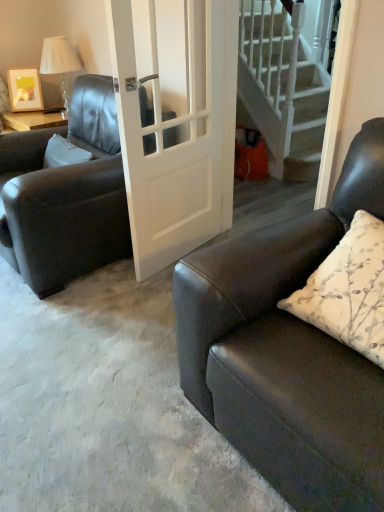
Locate an element on the screen. The height and width of the screenshot is (512, 384). wooden picture frame at upper left is located at coordinates (25, 90).

This screenshot has height=512, width=384. What do you see at coordinates (180, 143) in the screenshot? I see `white glossy door at center` at bounding box center [180, 143].

What do you see at coordinates (348, 290) in the screenshot?
I see `white floral pillow at right` at bounding box center [348, 290].

What do you see at coordinates (287, 351) in the screenshot? I see `matte black couch at right` at bounding box center [287, 351].

Find the location of `wooden picture frame at upper left`. wooden picture frame at upper left is located at coordinates (25, 90).

Locate an element on the screen. pillow below the wooden picture frame at upper left (from a real-world perspective) is located at coordinates (348, 290).

Considering the positions of objects wooden picture frame at upper left and white floral pillow at right in the image provided, who is in front, wooden picture frame at upper left or white floral pillow at right?

white floral pillow at right.

From the image's perspective, is wooden picture frame at upper left under white floral pillow at right?

No.

Is white fabric lampshade at upper left further to the viewer compared to white glossy door at center?

That is True.

Between white fabric lampshade at upper left and white glossy door at center, which one has less height?

white fabric lampshade at upper left.

The height and width of the screenshot is (512, 384). Find the location of `door that is below the white fabric lampshade at upper left (from the image's perspective)`. door that is below the white fabric lampshade at upper left (from the image's perspective) is located at coordinates (180, 143).

Is white wooden stairs at upper right far away from white glossy door at center?

Yes.

From a real-world perspective, is white wooden stairs at upper right positioned over white glossy door at center based on gravity?

No, from a real-world perspective, white wooden stairs at upper right is not over white glossy door at center

Which object is positioned more to the left, white wooden stairs at upper right or white glossy door at center?

white glossy door at center.

Considering the sizes of wooden picture frame at upper left and white fabric lampshade at upper left in the image, is wooden picture frame at upper left taller or shorter than white fabric lampshade at upper left?

Clearly, wooden picture frame at upper left is shorter compared to white fabric lampshade at upper left.

From a real-world perspective, relative to white fabric lampshade at upper left, is wooden picture frame at upper left vertically above or below?

From a real-world perspective, wooden picture frame at upper left is physically below white fabric lampshade at upper left.

Does wooden picture frame at upper left touch white fabric lampshade at upper left?

No.

Is wooden picture frame at upper left thinner than white fabric lampshade at upper left?

Correct, the width of wooden picture frame at upper left is less than that of white fabric lampshade at upper left.

From a real-world perspective, is matte black couch at right positioned above or below white glossy door at center?

matte black couch at right is below white glossy door at center.

Is matte black couch at right facing towards white glossy door at center?

No, matte black couch at right is not facing towards white glossy door at center.

Is matte black couch at right directly adjacent to white glossy door at center?

They are not placed beside each other.

Could you tell me if wooden picture frame at upper left is facing matte black couch at right?

No.

From a real-world perspective, between wooden picture frame at upper left and matte black couch at right, who is vertically lower?

matte black couch at right, from a real-world perspective.

Can you confirm if wooden picture frame at upper left is wider than matte black couch at right?

Incorrect, the width of wooden picture frame at upper left does not surpass that of matte black couch at right.

From the image's perspective, which object appears higher, wooden picture frame at upper left or matte black couch at right?

wooden picture frame at upper left appears higher in the image.

Is white glossy door at center surrounded by wooden picture frame at upper left?

No.

Considering the sizes of objects wooden picture frame at upper left and white glossy door at center in the image provided, who is bigger, wooden picture frame at upper left or white glossy door at center?

A: white glossy door at center is bigger.

Which is nearer, (14,102) or (216,47)?

Clearly, point (14,102) is more distant from the camera than point (216,47).

Find the location of a particular element. This screenshot has width=384, height=512. picture frame lying behind the white floral pillow at right is located at coordinates (25, 90).

Image resolution: width=384 pixels, height=512 pixels. Identify the location of door on the right side of white fabric lampshade at upper left. (180, 143).

Considering their positions, is white fabric lampshade at upper left positioned further to white glossy door at center than matte black couch at right?

white fabric lampshade at upper left lies further to white glossy door at center than the other object.

When comparing their distances from matte black couch at right, does wooden picture frame at upper left or matte black leather chair at left seem closer?

matte black leather chair at left is closer to matte black couch at right.

Estimate the real-world distances between objects in this image. Which object is further from white glossy door at center, white wooden stairs at upper right or wooden picture frame at upper left?

wooden picture frame at upper left.

Considering their positions, is white glossy door at center positioned further to white floral pillow at right than matte black leather chair at left?

matte black leather chair at left is positioned further to the anchor white floral pillow at right.

From the image, which object appears to be farther from matte black couch at right, white wooden stairs at upper right or wooden picture frame at upper left?

The object further to matte black couch at right is wooden picture frame at upper left.

When comparing their distances from wooden picture frame at upper left, does white wooden stairs at upper right or white glossy door at center seem closer?

white glossy door at center lies closer to wooden picture frame at upper left than the other object.

Looking at this image, from the image, which object appears to be farther from matte black leather chair at left, white wooden stairs at upper right or matte black couch at right?

white wooden stairs at upper right is positioned further to the anchor matte black leather chair at left.

When comparing their distances from matte black leather chair at left, does white fabric lampshade at upper left or matte black couch at right seem further?

matte black couch at right is positioned further to the anchor matte black leather chair at left.

Where is `lamp between matte black couch at right and wooden picture frame at upper left in the front-back direction`? The width and height of the screenshot is (384, 512). lamp between matte black couch at right and wooden picture frame at upper left in the front-back direction is located at coordinates (59, 61).

Locate an element on the screen. The height and width of the screenshot is (512, 384). door between matte black couch at right and white wooden stairs at upper right along the z-axis is located at coordinates (180, 143).

Identify the location of pillow between matte black couch at right and white wooden stairs at upper right in the front-back direction. (348, 290).

Find the location of a particular element. This screenshot has width=384, height=512. door located between matte black couch at right and wooden picture frame at upper left in the depth direction is located at coordinates (180, 143).